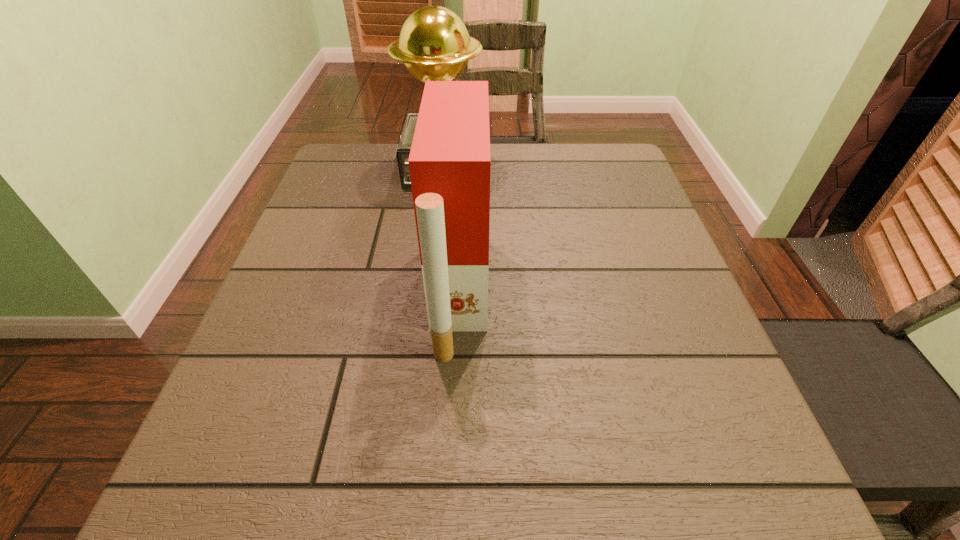
Where is `the farther object`? the farther object is located at coordinates (434, 45).

At what (x,y) coordinates should I click in order to perform the action: click on the nearer object. Please return your answer as a coordinate pair (x, y). Looking at the image, I should click on (449, 163).

I want to click on blank area located on the front-facing side of the farther object, so click(x=558, y=168).

The image size is (960, 540). What are the coordinates of `vacant space located on the front-facing side of the cigarette case` in the screenshot? It's located at (679, 292).

The height and width of the screenshot is (540, 960). I want to click on object that is at the far edge, so click(434, 45).

At what (x,y) coordinates should I click in order to perform the action: click on free space at the far edge of the desktop. Please return your answer as a coordinate pair (x, y). The width and height of the screenshot is (960, 540). Looking at the image, I should click on (514, 149).

Locate an element on the screen. vacant area at the near edge of the desktop is located at coordinates (602, 467).

This screenshot has width=960, height=540. Find the location of `free spot at the left edge of the desktop`. free spot at the left edge of the desktop is located at coordinates (331, 281).

You are a GUI agent. You are given a task and a screenshot of the screen. Output one action in this format:
    pyautogui.click(x=<x>, y=<y>)
    Task: Click on the free space at the right edge of the desktop
    The image size is (960, 540).
    Given the screenshot: What is the action you would take?
    pyautogui.click(x=724, y=363)

At what (x,y) coordinates should I click in order to perform the action: click on vacant space at the far left corner of the desktop. Please return your answer as a coordinate pair (x, y). The width and height of the screenshot is (960, 540). Looking at the image, I should click on (382, 153).